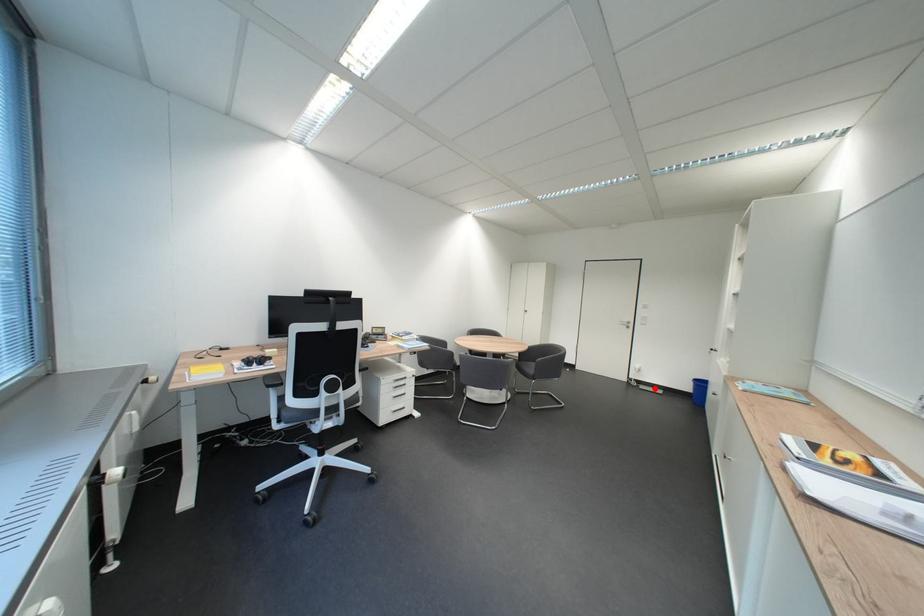
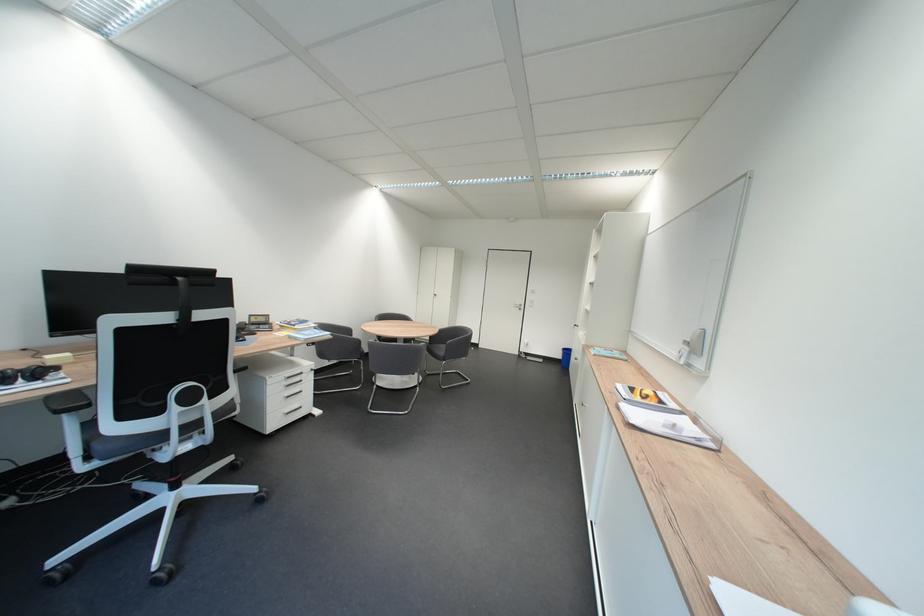
Question: I am providing you with two images of the same scene from different viewpoints. Given a red point in image1, look at the same physical point in image2. Is it:

Choices:
 (A) Closer to the viewpoint
 (B) Farther from the viewpoint

Answer: (B)